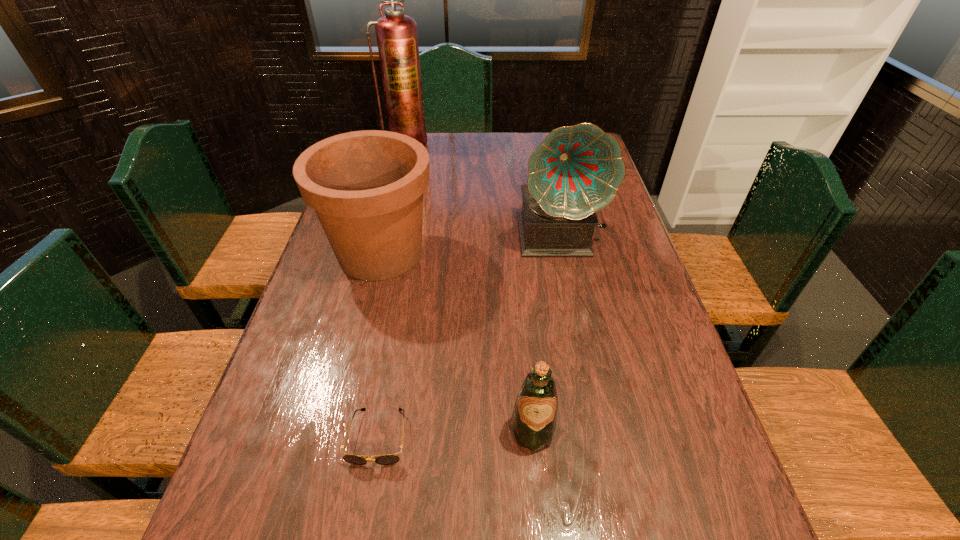
Where is `free space that satisfies the following two spatial constraints: 1. on the side of the farthest object with the label; 2. on the right side of the flowerpot`? free space that satisfies the following two spatial constraints: 1. on the side of the farthest object with the label; 2. on the right side of the flowerpot is located at coordinates (380, 253).